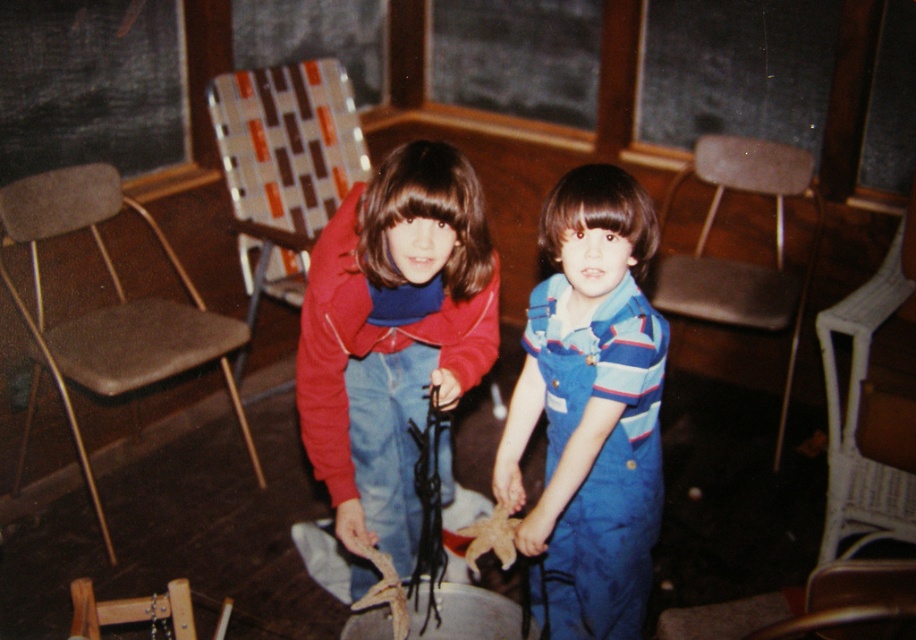
You are a parent trying to ensure the fire pit area is safe. You need to move the blue denim overalls at center and the patterned fabric chair at upper left to a safer distance of at least 2 meters apart. Are they currently positioned safely?

The blue denim overalls at center is 1.42 meters from the patterned fabric chair at upper left. Since 1.42 meters is less than the required 2 meters, they are not positioned safely and need to be moved further apart.

You are a parent trying to place a 5 feet long wooden board between the brown fabric chair at center and the brown leather chair at lower right. Can the board fit between them without bending or breaking?

The distance between the brown fabric chair at center and the brown leather chair at lower right is 4.91 feet. Since the board is 5 feet long, it is slightly longer than the available space. Therefore, the board cannot fit between them without bending or breaking.